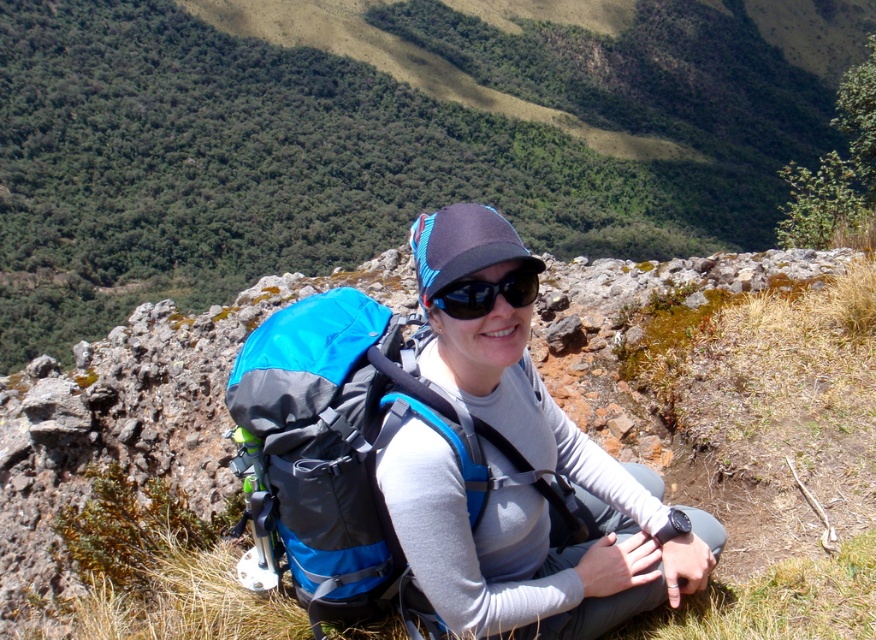
Is green leafy hillside at upper center below black reflective sunglasses at center?

No, green leafy hillside at upper center is not below black reflective sunglasses at center.

Who is shorter, green leafy hillside at upper center or black reflective sunglasses at center?

black reflective sunglasses at center is shorter.

The width and height of the screenshot is (876, 640). I want to click on green leafy hillside at upper center, so click(x=386, y=134).

Is point (57, 289) less distant than point (340, 461)?

No, (57, 289) is further to viewer.

Does green leafy hillside at upper center have a lesser height compared to blue fabric backpack at center?

No, green leafy hillside at upper center is not shorter than blue fabric backpack at center.

The height and width of the screenshot is (640, 876). What are the coordinates of `green leafy hillside at upper center` in the screenshot? It's located at (386, 134).

In the scene shown: Does green leafy hillside at upper center appear under gray fabric backpack at center?

Actually, green leafy hillside at upper center is above gray fabric backpack at center.

Is green leafy hillside at upper center above gray fabric backpack at center?

Yes, green leafy hillside at upper center is above gray fabric backpack at center.

Which is behind, point (97, 173) or point (498, 612)?

Positioned behind is point (97, 173).

Where is `green leafy hillside at upper center`? The image size is (876, 640). green leafy hillside at upper center is located at coordinates (386, 134).